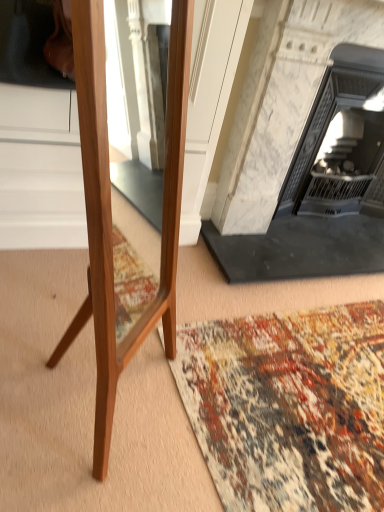
Question: Which direction should I rotate to look at white marble fireplace at center, the 2th fireplace in the right-to-left sequence?

Choices:
 (A) right
 (B) left

Answer: (A)

Question: Are multicolored woven rug at lower center and white marble fireplace at upper right, the 2th fireplace viewed from the left, beside each other?

Choices:
 (A) yes
 (B) no

Answer: (B)

Question: Does multicolored woven rug at lower center have a lesser height compared to white marble fireplace at upper right, the 2th fireplace viewed from the left?

Choices:
 (A) yes
 (B) no

Answer: (A)

Question: From a real-world perspective, is multicolored woven rug at lower center below white marble fireplace at upper right, the 2th fireplace viewed from the left?

Choices:
 (A) yes
 (B) no

Answer: (A)

Question: From a real-world perspective, is multicolored woven rug at lower center located higher than white marble fireplace at upper right, placed as the 1th fireplace when sorted from right to left?

Choices:
 (A) no
 (B) yes

Answer: (A)

Question: Could white marble fireplace at upper right, placed as the 1th fireplace when sorted from right to left, be considered to be inside multicolored woven rug at lower center?

Choices:
 (A) no
 (B) yes

Answer: (A)

Question: Considering the relative sizes of multicolored woven rug at lower center and white marble fireplace at upper right, the 2th fireplace viewed from the left, in the image provided, is multicolored woven rug at lower center bigger than white marble fireplace at upper right, the 2th fireplace viewed from the left,?

Choices:
 (A) no
 (B) yes

Answer: (A)

Question: From the image's perspective, is white marble fireplace at center, arranged as the 1th fireplace when viewed from the left, on top of multicolored woven rug at lower center?

Choices:
 (A) no
 (B) yes

Answer: (B)

Question: Is white marble fireplace at center, the 2th fireplace in the right-to-left sequence, shorter than multicolored woven rug at lower center?

Choices:
 (A) yes
 (B) no

Answer: (B)

Question: Is multicolored woven rug at lower center located within white marble fireplace at center, arranged as the 1th fireplace when viewed from the left?

Choices:
 (A) yes
 (B) no

Answer: (B)

Question: Is the position of white marble fireplace at center, arranged as the 1th fireplace when viewed from the left, more distant than that of multicolored woven rug at lower center?

Choices:
 (A) yes
 (B) no

Answer: (A)

Question: Is white marble fireplace at center, the 2th fireplace in the right-to-left sequence, to the right of multicolored woven rug at lower center from the viewer's perspective?

Choices:
 (A) no
 (B) yes

Answer: (B)

Question: Considering the relative sizes of white marble fireplace at center, the 2th fireplace in the right-to-left sequence, and multicolored woven rug at lower center in the image provided, is white marble fireplace at center, the 2th fireplace in the right-to-left sequence, bigger than multicolored woven rug at lower center?

Choices:
 (A) yes
 (B) no

Answer: (A)

Question: Is the surface of white marble fireplace at upper right, placed as the 1th fireplace when sorted from right to left, in direct contact with white marble fireplace at center, the 2th fireplace in the right-to-left sequence?

Choices:
 (A) yes
 (B) no

Answer: (B)